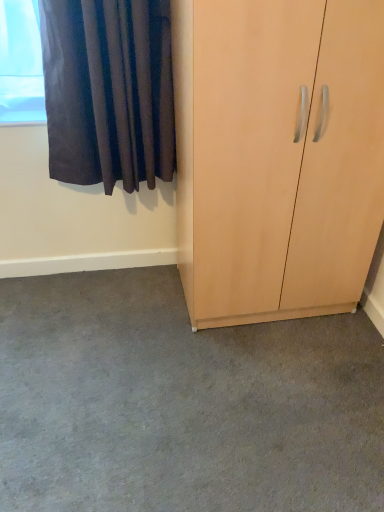
The width and height of the screenshot is (384, 512). Identify the location of unoccupied area in front of light wood cupboard at right. (265, 388).